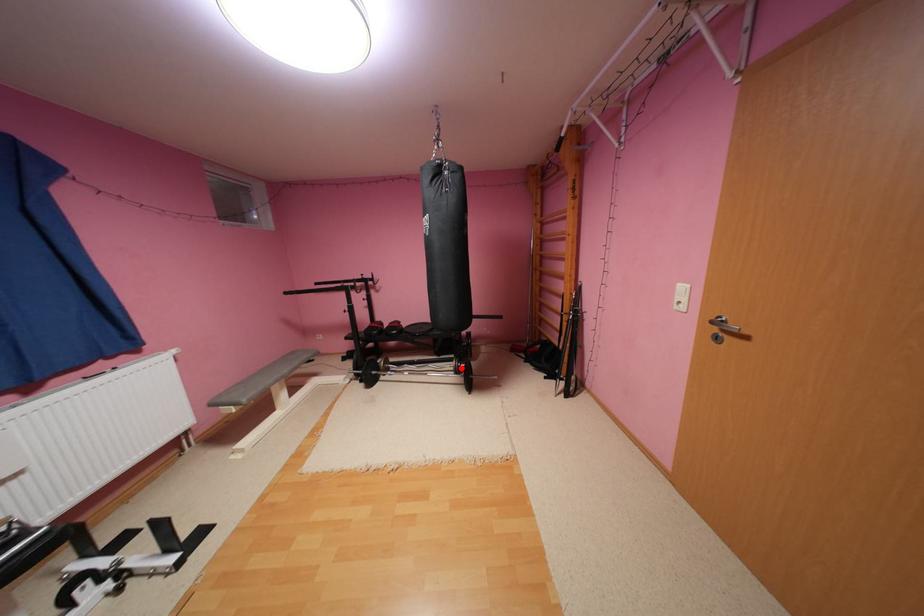
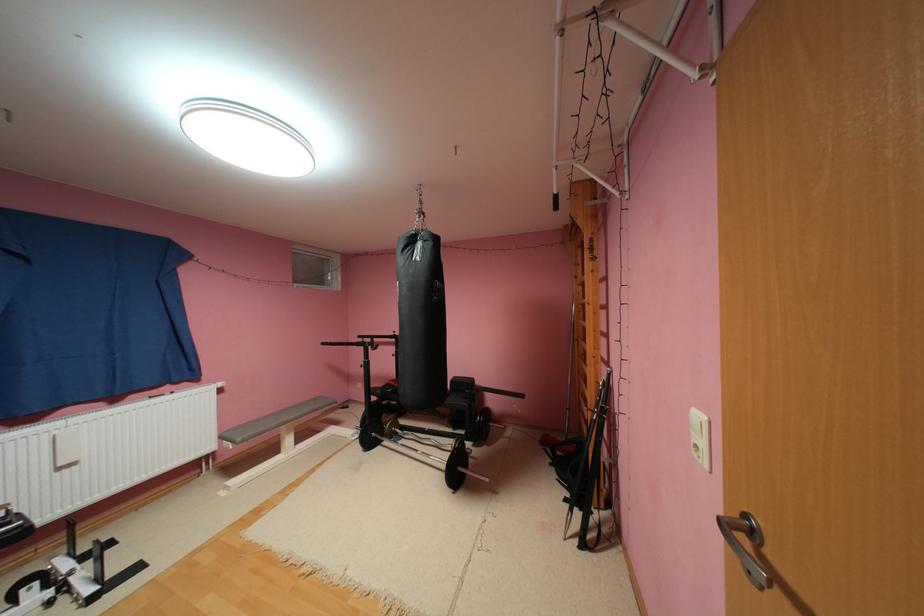
Locate, in the second image, the point that corresponds to the highlighted location in the first image.

(458, 450)